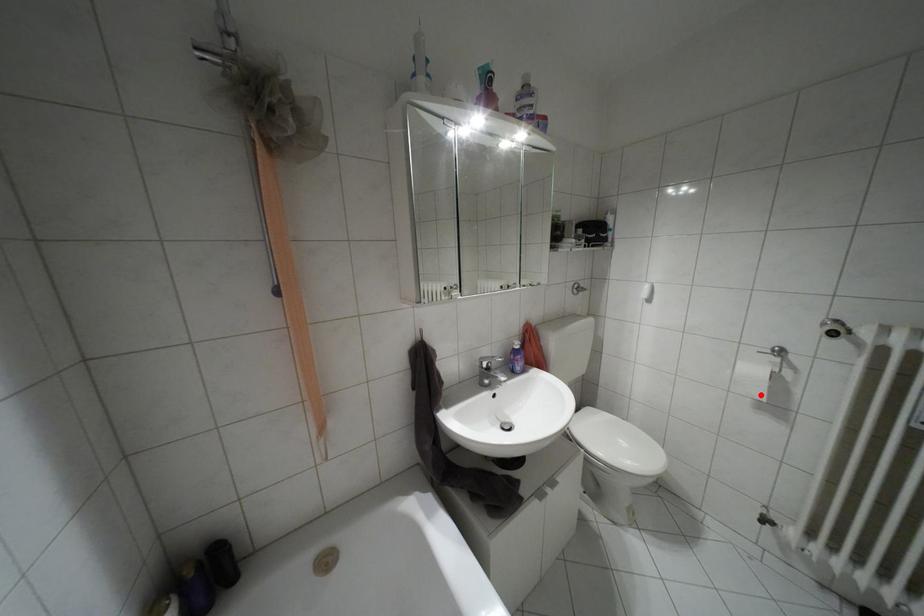
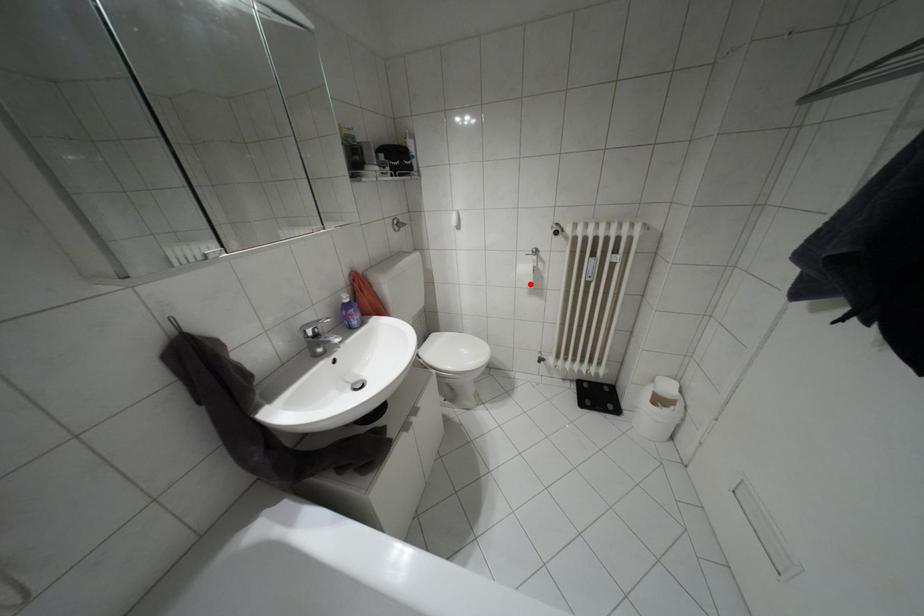
I am providing you with two images of the same scene from different viewpoints. A red point is marked on the first image and another point is marked on the second image. Does the point marked in image1 correspond to the same location as the one in image2?

Yes